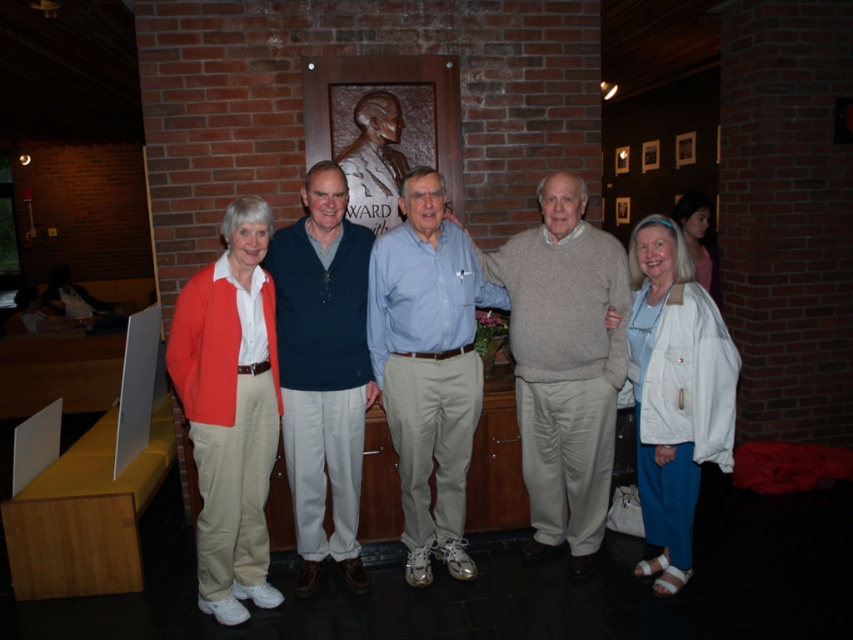
Question: Is light brown sweater at center bigger than matte orange cardigan at left?

Choices:
 (A) no
 (B) yes

Answer: (B)

Question: Among these objects, which one is nearest to the camera?

Choices:
 (A) dark blue sweater at center
 (B) light brown sweater at center
 (C) light blue shirt at center

Answer: (A)

Question: Does light brown sweater at center have a greater width compared to dark blue sweater at center?

Choices:
 (A) yes
 (B) no

Answer: (A)

Question: Which of the following is the closest to the observer?

Choices:
 (A) (270, 236)
 (B) (299, 404)
 (C) (428, 540)

Answer: (A)

Question: Observing the image, what is the correct spatial positioning of light brown sweater at center in reference to dark blue sweater at center?

Choices:
 (A) below
 (B) above

Answer: (B)

Question: Which point is closer to the camera?

Choices:
 (A) (521, 369)
 (B) (369, 368)
 (C) (263, 323)
 (D) (373, 296)

Answer: (C)